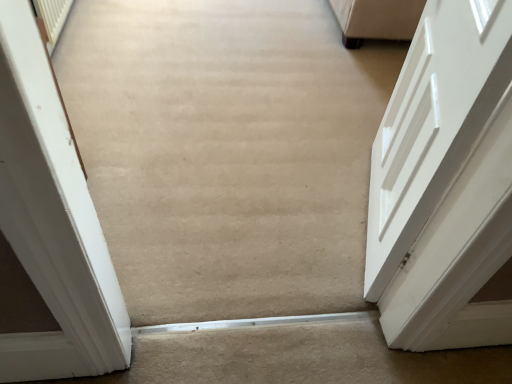
Describe the element at coordinates (433, 123) in the screenshot. I see `white glossy door at right` at that location.

You are a GUI agent. You are given a task and a screenshot of the screen. Output one action in this format:
    pyautogui.click(x=<x>, y=<y>)
    Task: Click on the white glossy door at right
    Image resolution: width=512 pixels, height=384 pixels.
    Given the screenshot: What is the action you would take?
    pyautogui.click(x=433, y=123)

You are a GUI agent. You are given a task and a screenshot of the screen. Output one action in this format:
    pyautogui.click(x=<x>, y=<y>)
    Task: Click on the white glossy door at right
    This screenshot has width=512, height=384.
    Given the screenshot: What is the action you would take?
    pyautogui.click(x=433, y=123)